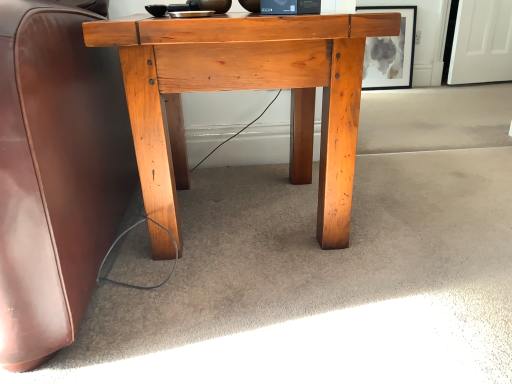
Locate an element on the screen. This screenshot has height=384, width=512. vacant area that lies in front of natural wood desk at center is located at coordinates (270, 319).